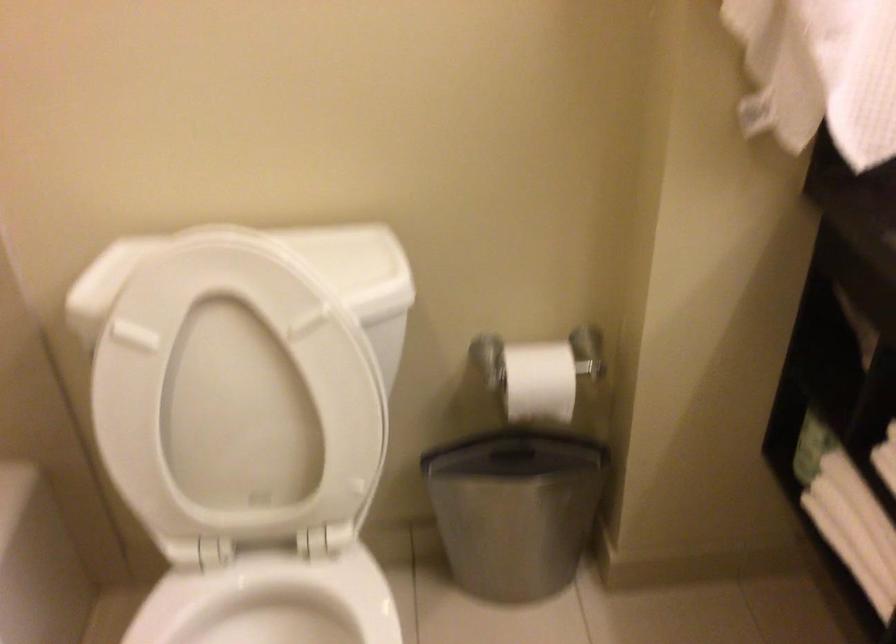
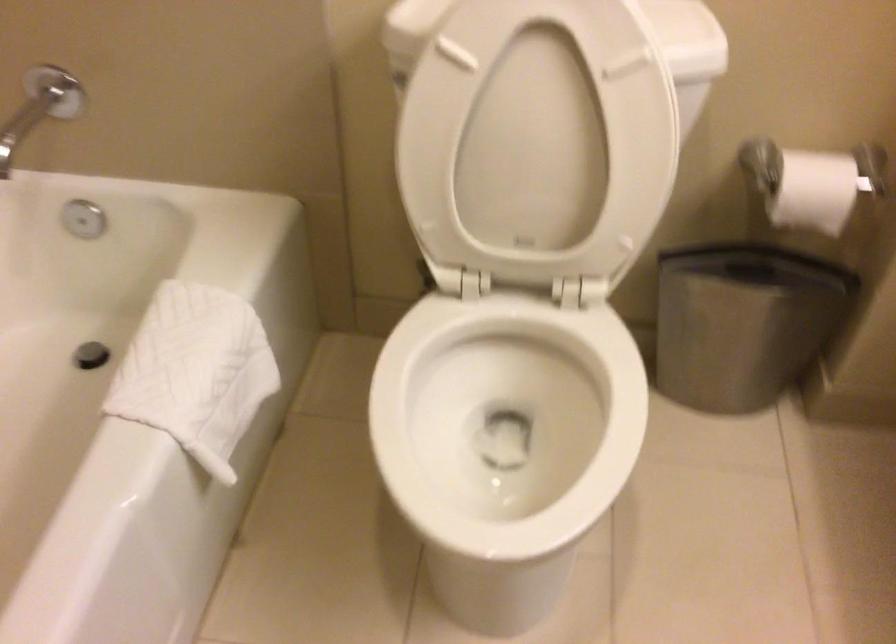
In the second image, find the point that corresponds to the point at 248,406 in the first image.

(538, 140)